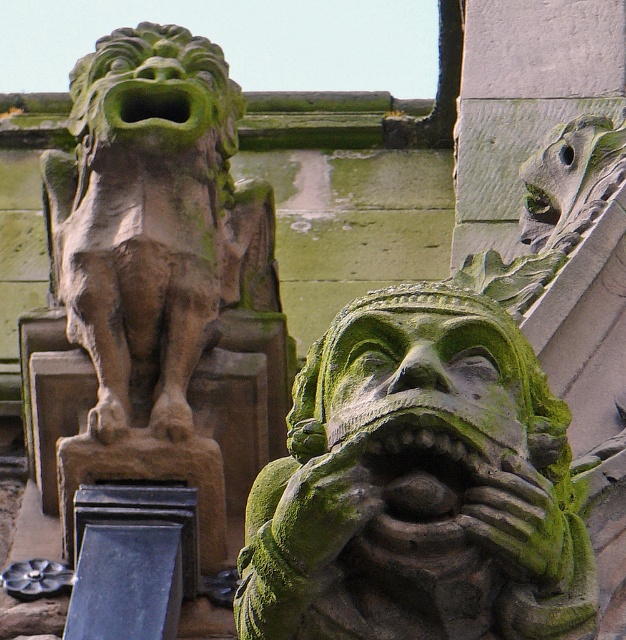
Is green mossy stone lion at center to the right of green mossy stone face at center from the viewer's perspective?

Yes, green mossy stone lion at center is to the right of green mossy stone face at center.

Can you confirm if green mossy stone lion at center is taller than green mossy stone face at center?

Yes.

The image size is (626, 640). What do you see at coordinates (418, 483) in the screenshot?
I see `green mossy stone lion at center` at bounding box center [418, 483].

Locate an element on the screen. This screenshot has width=626, height=640. green mossy stone lion at center is located at coordinates (418, 483).